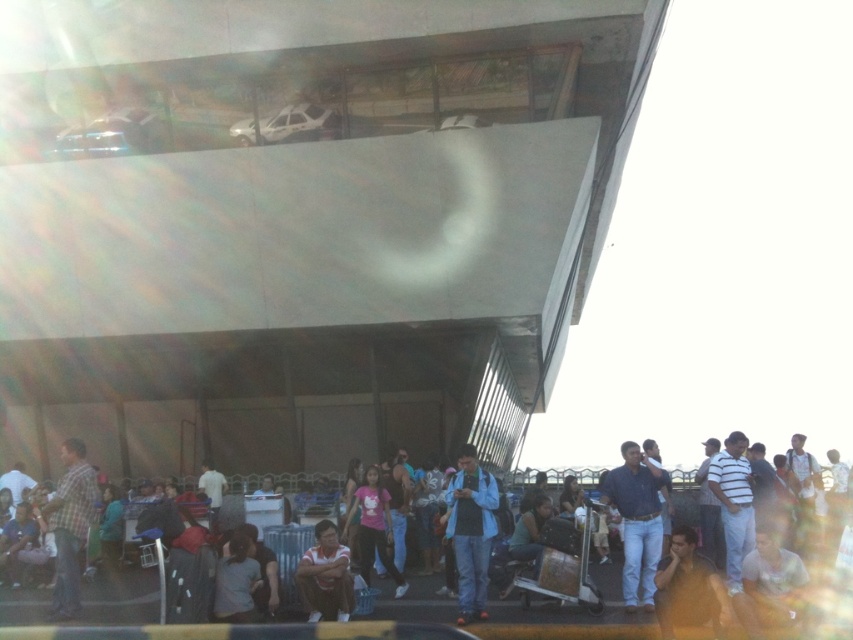
Question: Which object is farther from the camera taking this photo?

Choices:
 (A) dark blue jeans at lower center
 (B) plaid fabric shirt at lower left

Answer: (B)

Question: Does blue denim jacket at center appear on the right side of matte yellow shirt at lower right?

Choices:
 (A) yes
 (B) no

Answer: (B)

Question: Among these objects, which one is nearest to the camera?

Choices:
 (A) matte yellow shirt at lower right
 (B) blue denim jeans at center
 (C) striped cotton shirt at right

Answer: (A)

Question: Does blue denim jeans at center have a lesser width compared to dark blue jeans at lower center?

Choices:
 (A) yes
 (B) no

Answer: (A)

Question: Does striped cotton shirt at right have a greater width compared to white shirt at center?

Choices:
 (A) no
 (B) yes

Answer: (B)

Question: Which of the following is the farthest from the observer?

Choices:
 (A) (619, 506)
 (B) (486, 577)

Answer: (A)